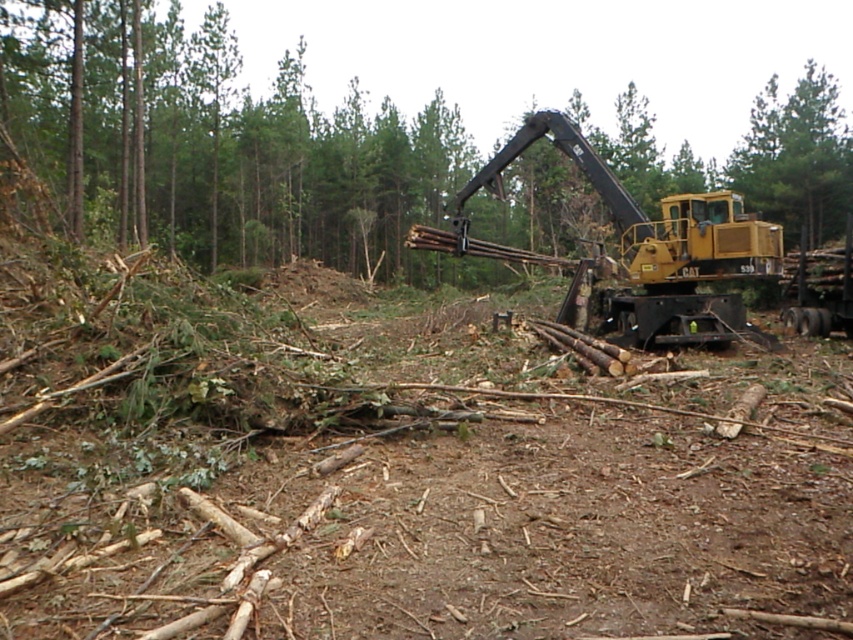
Question: Which point is farther to the camera?

Choices:
 (A) green rough bark tree at upper right
 (B) green leafy tree at center

Answer: (A)

Question: Can you confirm if green leafy tree at center is wider than green rough bark tree at upper right?

Choices:
 (A) no
 (B) yes

Answer: (B)

Question: Among these objects, which one is farthest from the camera?

Choices:
 (A) green leafy tree at center
 (B) yellow metallic excavator at right

Answer: (A)

Question: Is green leafy tree at center above yellow metallic excavator at right?

Choices:
 (A) yes
 (B) no

Answer: (A)

Question: Estimate the real-world distances between objects in this image. Which object is farther from the green leafy tree at center?

Choices:
 (A) yellow metallic excavator at right
 (B) green rough bark tree at upper right

Answer: (B)

Question: Can you confirm if green leafy tree at center is positioned to the right of yellow metallic excavator at right?

Choices:
 (A) no
 (B) yes

Answer: (A)